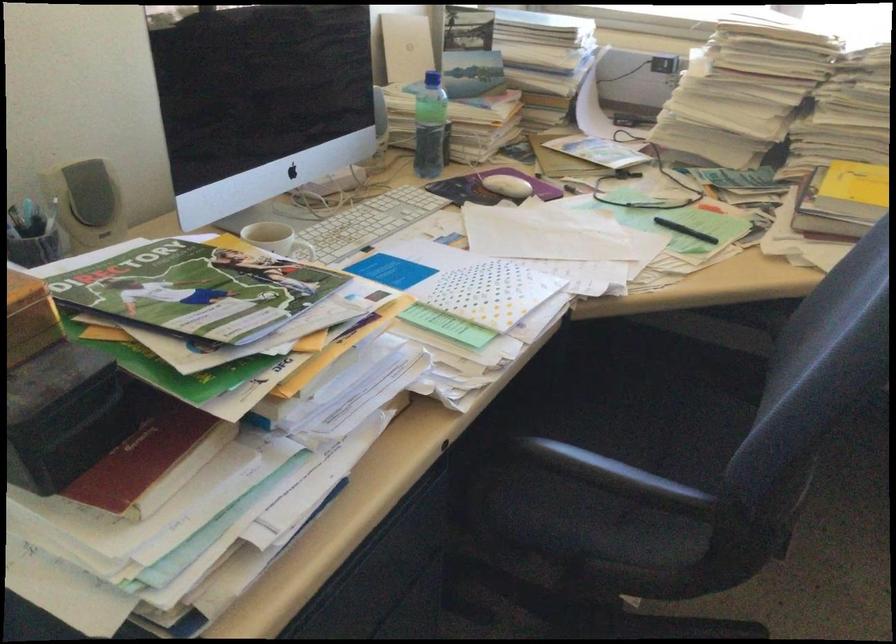
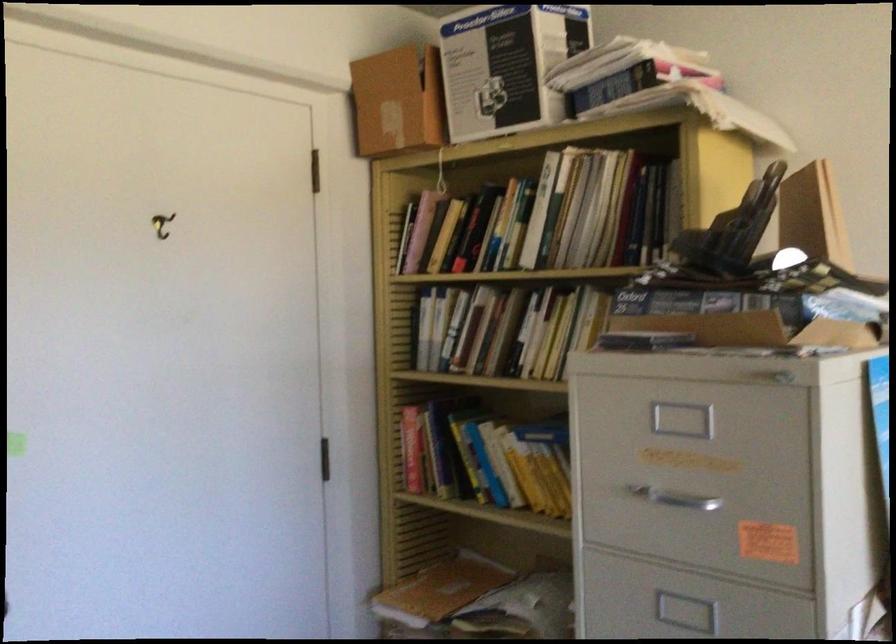
Question: Based on the continuous images, in which direction is the camera rotating? Reply with the corresponding letter.

Choices:
 (A) Left
 (B) Right
 (C) Up
 (D) Down

Answer: (A)